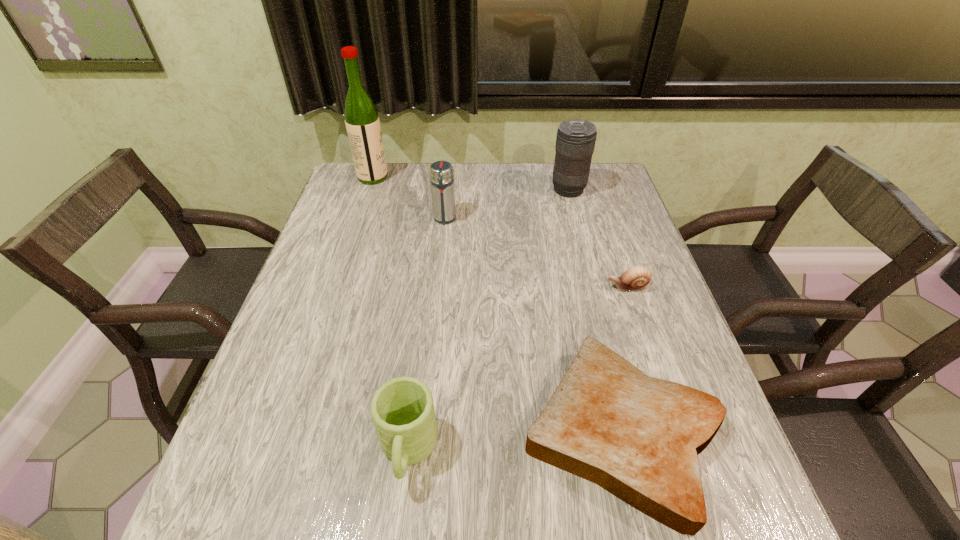
The image size is (960, 540). What are the coordinates of `empty space between the bread and the liquor` in the screenshot? It's located at (497, 304).

Where is `vacant space that's between the thermos bottle and the liquor`? The height and width of the screenshot is (540, 960). vacant space that's between the thermos bottle and the liquor is located at coordinates (409, 198).

The height and width of the screenshot is (540, 960). In order to click on free point between the mug and the liquor in this screenshot , I will do `click(391, 314)`.

Locate an element on the screen. This screenshot has width=960, height=540. object that stands as the third closest to the fifth shortest object is located at coordinates (362, 122).

I want to click on the closest object to the fourth shortest object, so click(362, 122).

Identify the location of free space that satisfies the following two spatial constraints: 1. on the side of the telephoto lens where the control switches are located; 2. on the front side of the bread. Image resolution: width=960 pixels, height=540 pixels. (631, 431).

Locate an element on the screen. The image size is (960, 540). vacant region that satisfies the following two spatial constraints: 1. on the side of the second tallest object where the control switches are located; 2. on the side of the mug with the handle is located at coordinates (636, 451).

The image size is (960, 540). Identify the location of vacant region that satisfies the following two spatial constraints: 1. on the side of the telephoto lens where the control switches are located; 2. with a handle on the side of the thermos bottle. (576, 219).

You are a GUI agent. You are given a task and a screenshot of the screen. Output one action in this format:
    pyautogui.click(x=<x>, y=<y>)
    Task: Click on the vacant space that satisfies the following two spatial constraints: 1. on the label of the bread; 2. on the right side of the liquor
    
    Given the screenshot: What is the action you would take?
    pyautogui.click(x=290, y=431)

You are a GUI agent. You are given a task and a screenshot of the screen. Output one action in this format:
    pyautogui.click(x=<x>, y=<y>)
    Task: Click on the vacant region that satisfies the following two spatial constraints: 1. on the label of the tallest object; 2. on the back side of the bread
    
    Given the screenshot: What is the action you would take?
    pyautogui.click(x=290, y=431)